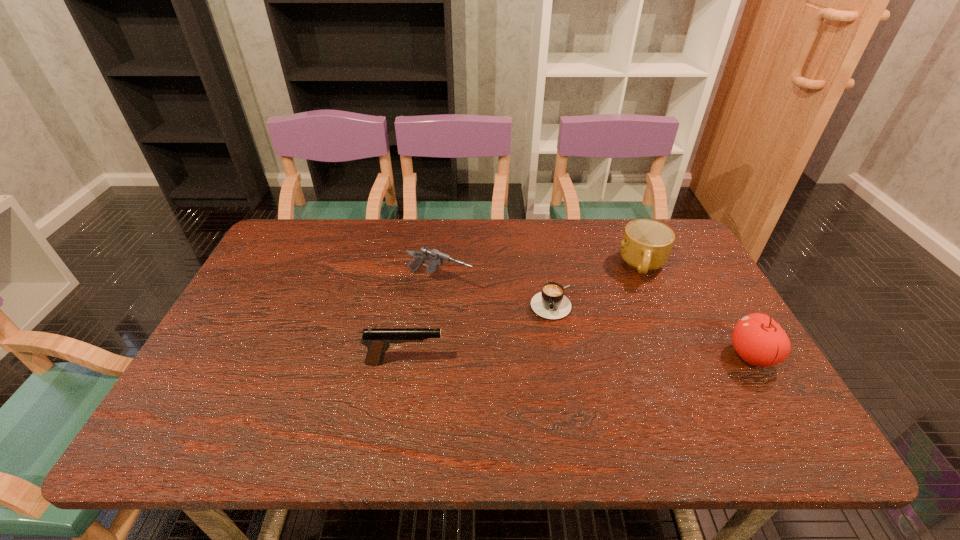
Find the location of a particular element. This screenshot has width=960, height=540. vacant space located 0.230m on the side with the handle of the mug is located at coordinates (615, 336).

Find the location of a particular element. Image resolution: width=960 pixels, height=540 pixels. vacant space located 0.170m with the handle on the side of the shortest object is located at coordinates (548, 372).

Locate an element on the screen. This screenshot has height=540, width=960. vacant area situated 0.070m with the handle on the side of the shortest object is located at coordinates (550, 341).

Where is `blank space located with the handle on the side of the shortest object`? This screenshot has height=540, width=960. blank space located with the handle on the side of the shortest object is located at coordinates (548, 376).

Find the location of `vacant space situated 0.190m at the barrel of the gun`. vacant space situated 0.190m at the barrel of the gun is located at coordinates (529, 314).

Locate an element on the screen. vacant space located 0.320m at the barrel of the gun is located at coordinates (574, 333).

At what (x,y) coordinates should I click in order to perform the action: click on free point located 0.270m at the barrel of the gun. Please return your answer as a coordinate pair (x, y). This screenshot has height=540, width=960. Looking at the image, I should click on (556, 326).

Locate an element on the screen. This screenshot has width=960, height=540. object positioned at the far edge is located at coordinates (646, 245).

Locate an element on the screen. apple positioned at the right edge is located at coordinates (758, 339).

I want to click on mug located in the right edge section of the desktop, so click(x=646, y=245).